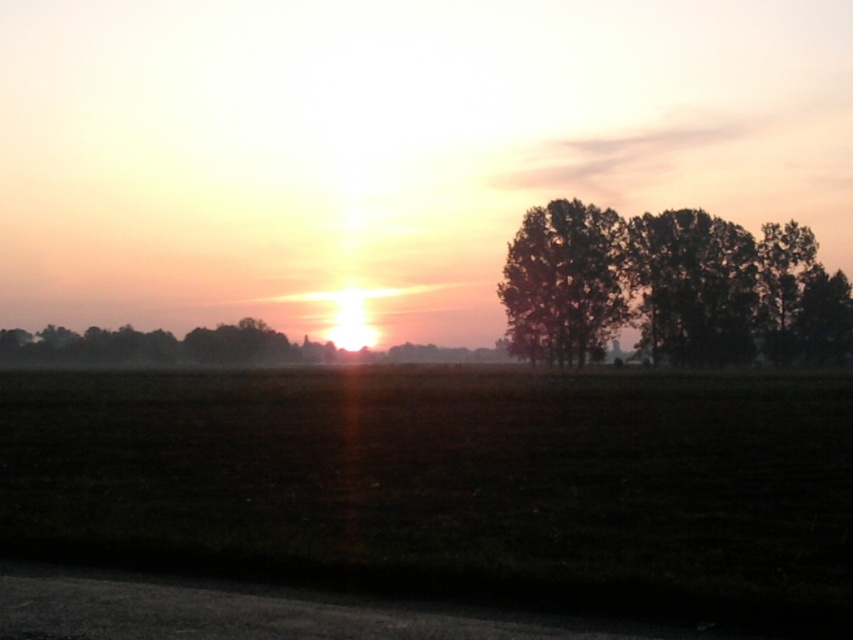
Question: Can you confirm if dark soil field at center is bigger than dark green leafy trees at right?

Choices:
 (A) yes
 (B) no

Answer: (B)

Question: Which point is farther to the camera?

Choices:
 (A) silhouette leafy tree at right
 (B) dark soil field at center
 (C) dark green leafy trees at right

Answer: (C)

Question: Can you confirm if dark soil field at center is positioned below silhouette/leafy trees at right?

Choices:
 (A) no
 (B) yes

Answer: (B)

Question: Which object appears closest to the camera in this image?

Choices:
 (A) silhouette leafy tree at right
 (B) dark soil field at center
 (C) dark green leafy trees at right
 (D) silhouette/leafy trees at right

Answer: (B)

Question: Which of the following is the farthest from the observer?

Choices:
 (A) dark soil field at center
 (B) dark green leafy trees at right

Answer: (B)

Question: Is dark green leafy trees at right below silhouette leafy tree at right?

Choices:
 (A) no
 (B) yes

Answer: (A)